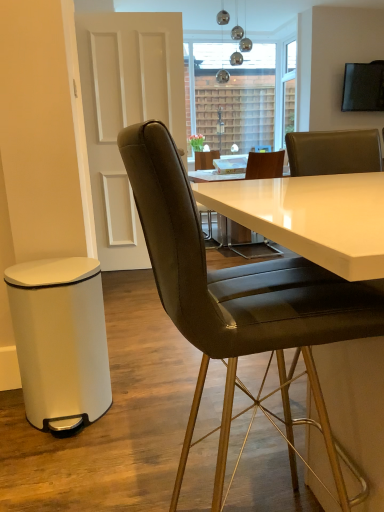
This screenshot has width=384, height=512. I want to click on vacant area that is situated to the right of white matte bar stool at lower left, so click(157, 411).